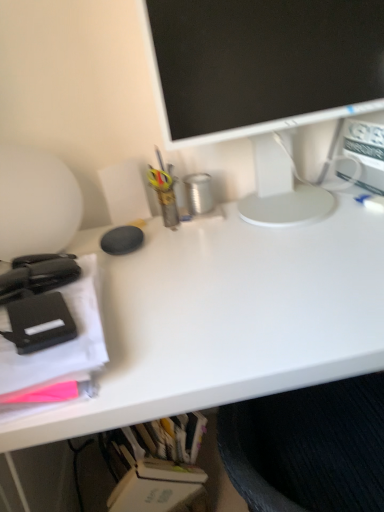
Locate an element on the screen. The image size is (384, 512). free area below white glossy monitor at upper center (from a real-world perspective) is located at coordinates (284, 208).